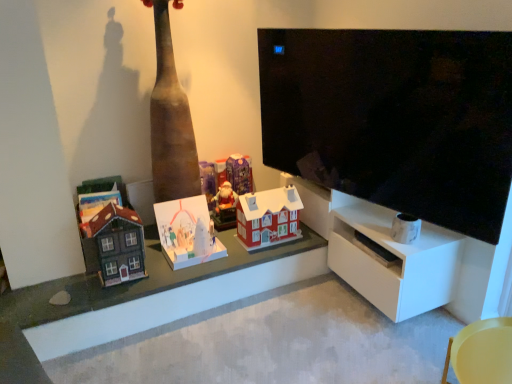
Question: From a real-world perspective, is wooden toy houses at center positioned above or below matte brown wooden house at left, the first toy viewed from the left?

Choices:
 (A) above
 (B) below

Answer: (B)

Question: In terms of height, does wooden toy houses at center look taller or shorter compared to matte brown wooden house at left, which appears as the 5th toy when viewed from the right?

Choices:
 (A) short
 (B) tall

Answer: (A)

Question: Which of these objects is positioned closest to the black glossy tv at upper right?

Choices:
 (A) white matte shelf at right
 (B) matte purple ornament at center, marked as the third toy in a right-to-left arrangement
 (C) yellow plastic chair at lower right
 (D) matte brown wooden house at left, the first toy viewed from the left
 (E) wooden toy houses at center

Answer: (A)

Question: Which is nearer to the wooden toy houses at center?

Choices:
 (A) purple glossy advent calendar at center, the 4th toy when ordered from left to right
 (B) white matte shelf at right
 (C) matte purple ornament at center, marked as the third toy in a right-to-left arrangement
 (D) yellow plastic chair at lower right
 (E) black glossy tv at upper right

Answer: (B)